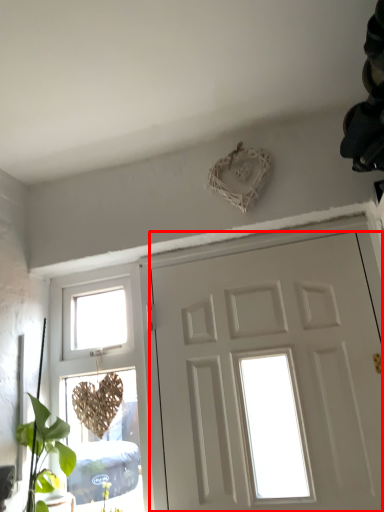
Question: Observing the image, what is the correct spatial positioning of door (annotated by the red box) in reference to window?

Choices:
 (A) right
 (B) left

Answer: (A)